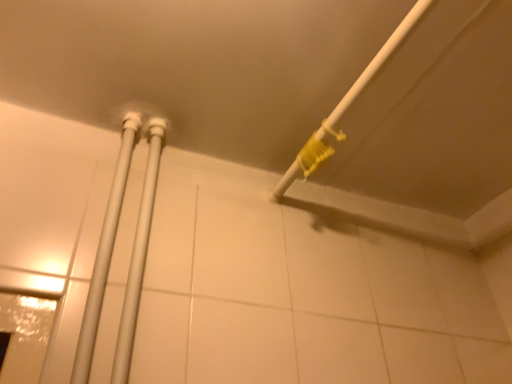
Image resolution: width=512 pixels, height=384 pixels. Identify the location of yellow matte pipe at upper right. click(x=346, y=106).

Describe the element at coordinates (346, 106) in the screenshot. The width and height of the screenshot is (512, 384). I see `yellow matte pipe at upper right` at that location.

Where is `yellow matte pipe at upper right`? The height and width of the screenshot is (384, 512). yellow matte pipe at upper right is located at coordinates (346, 106).